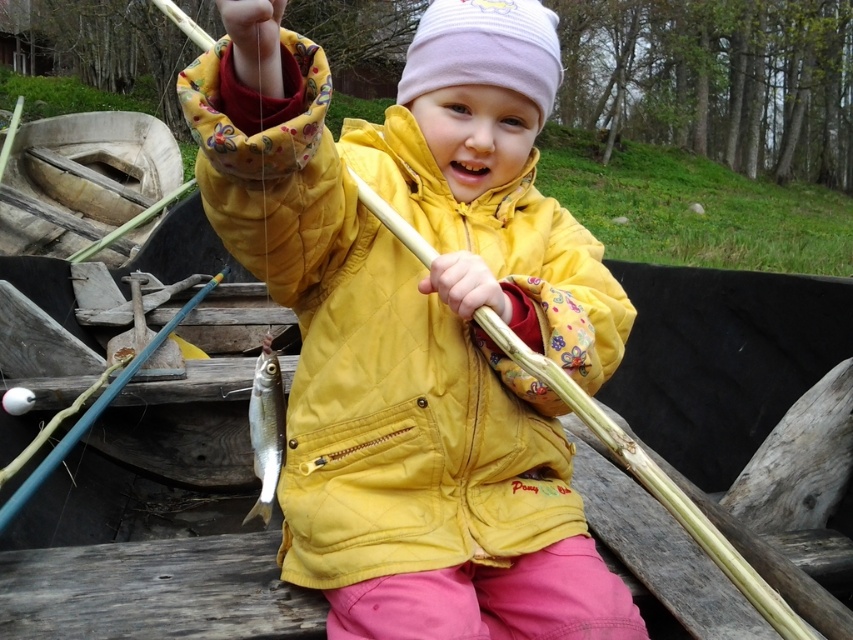
Is point (422, 492) positioned after point (254, 461)?

That is False.

Is yellow quilted jacket at center to the right of shiny silver fish at center from the viewer's perspective?

Correct, you'll find yellow quilted jacket at center to the right of shiny silver fish at center.

Is point (538, 262) positioned after point (252, 390)?

Yes.

Locate an element on the screen. yellow quilted jacket at center is located at coordinates (402, 339).